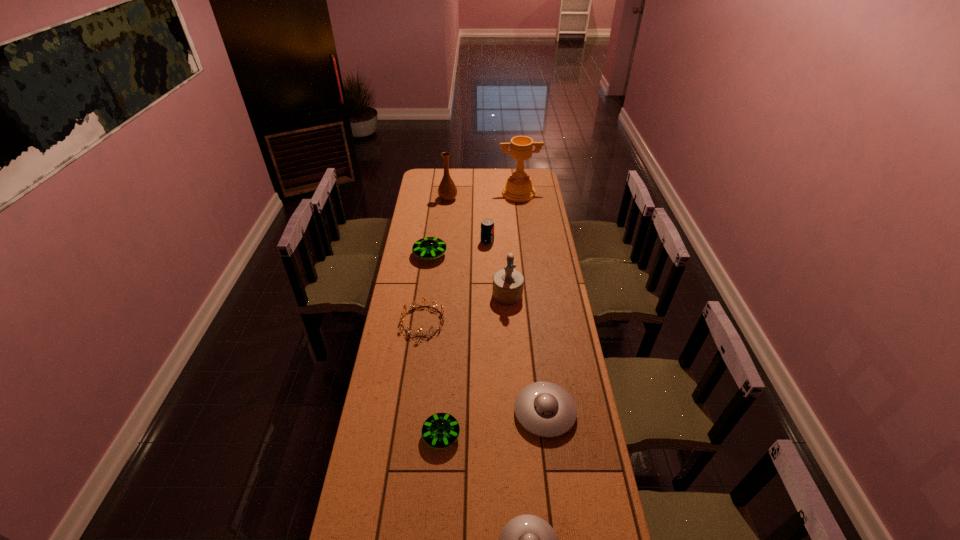
Find the location of a particular element. This screenshot has height=540, width=960. award is located at coordinates (518, 188).

Identify the location of vase. (447, 191).

I want to click on brown vase, so click(x=447, y=191).

I want to click on figurine, so click(x=508, y=283).

The image size is (960, 540). I want to click on the third tallest object, so click(x=508, y=283).

At what (x,y) coordinates should I click in order to perform the action: click on blue pop. Please return your answer as a coordinate pair (x, y). Looking at the image, I should click on (487, 226).

Where is `the sixth shortest object`? The image size is (960, 540). the sixth shortest object is located at coordinates (487, 226).

You are a GUI agent. You are given a task and a screenshot of the screen. Output one action in this format:
    pyautogui.click(x=<x>, y=<y>)
    Task: Click on the fifth tallest object
    
    Given the screenshot: What is the action you would take?
    pyautogui.click(x=427, y=248)

Identify the location of the tallest saucer. The width and height of the screenshot is (960, 540). (427, 248).

This screenshot has height=540, width=960. I want to click on the bigger gray saucer, so (545, 409).